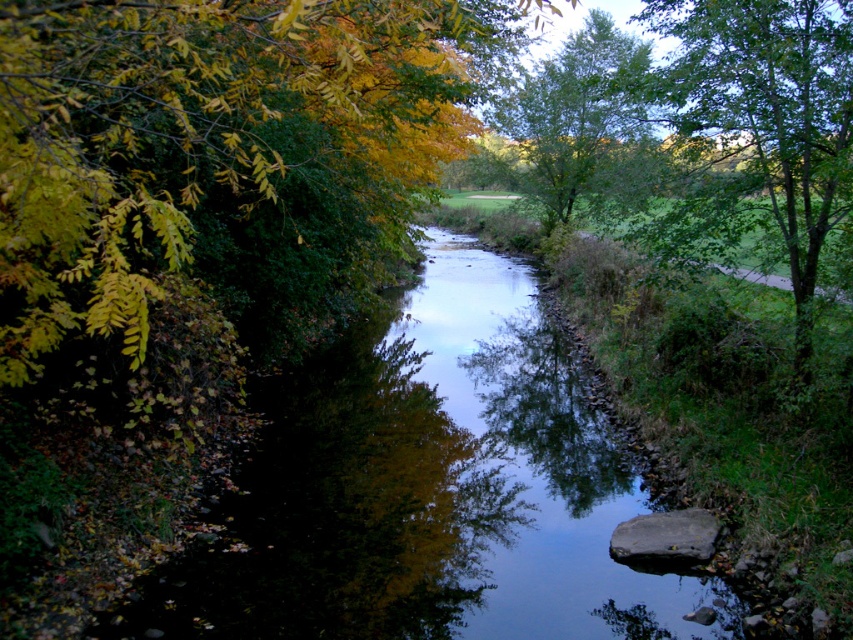
What are the coordinates of `yellow-green leaves at upper left` in the screenshot? It's located at point(196,132).

Does yellow-green leaves at upper left have a smaller size compared to green leafy tree at upper center?

Indeed, yellow-green leaves at upper left has a smaller size compared to green leafy tree at upper center.

Does point (380, 99) come in front of point (595, 92)?

Yes, point (380, 99) is in front of point (595, 92).

Find the location of a particular element. yellow-green leaves at upper left is located at coordinates (196, 132).

Can you confirm if yellow-green leaves at upper left is positioned above green leafy tree at right?

Incorrect, yellow-green leaves at upper left is not positioned above green leafy tree at right.

Between yellow-green leaves at upper left and green leafy tree at right, which one is positioned lower?

yellow-green leaves at upper left is below.

Find the location of a particular element. This screenshot has width=853, height=640. yellow-green leaves at upper left is located at coordinates (196, 132).

Identify the location of yellow-green leaves at upper left. The image size is (853, 640). (196, 132).

Between green leafy tree at right and green leafy tree at upper center, which one appears on the left side from the viewer's perspective?

From the viewer's perspective, green leafy tree at upper center appears more on the left side.

Measure the distance between green leafy tree at right and green leafy tree at upper center.

green leafy tree at right and green leafy tree at upper center are 3.83 meters apart from each other.

Identify the location of green leafy tree at right. This screenshot has height=640, width=853. click(772, 113).